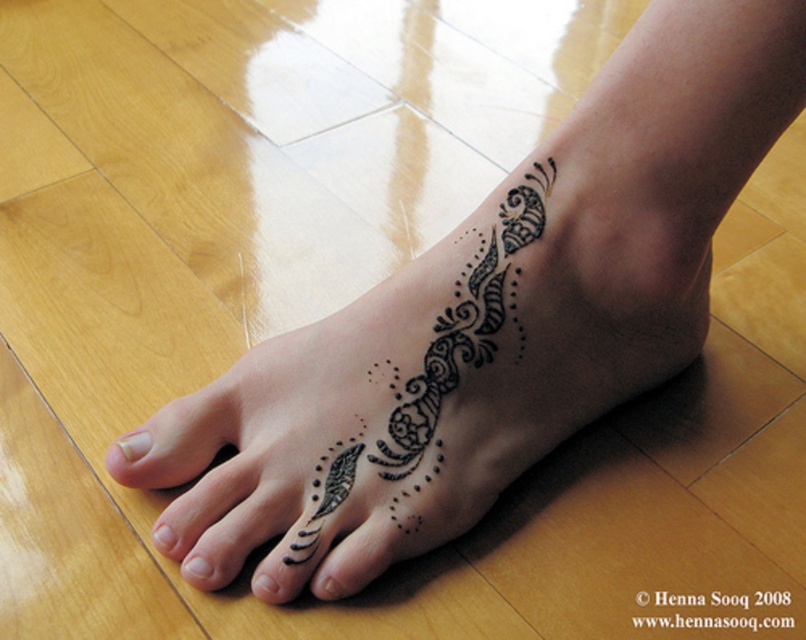
Who is positioned more to the right, black ink dot at lower center or black matte nail at lower left?

black ink dot at lower center

Can you confirm if black ink dot at lower center is wider than black matte nail at lower left?

Yes.

Identify the location of black ink dot at lower center. This screenshot has height=640, width=806. (264, 586).

This screenshot has height=640, width=806. Identify the location of black ink dot at lower center. (264, 586).

Between black ink tattoo at lower center and white matte nail at lower left, which one appears on the right side from the viewer's perspective?

black ink tattoo at lower center is more to the right.

Does point (406, 509) come closer to viewer compared to point (123, 458)?

That is True.

At what (x,y) coordinates should I click in order to perform the action: click on black ink tattoo at lower center. Please return your answer as a coordinate pair (x, y). This screenshot has width=806, height=640. Looking at the image, I should click on (429, 376).

Which of these two, black ink tattoo at lower center or black ink dot at lower center, stands shorter?

With less height is black ink dot at lower center.

Measure the distance between point (x=422, y=404) and camera.

Point (x=422, y=404) is 68.17 centimeters away from camera.

You are a GUI agent. You are given a task and a screenshot of the screen. Output one action in this format:
    pyautogui.click(x=<x>, y=<y>)
    Task: Click on the black ink tattoo at lower center
    The height and width of the screenshot is (640, 806).
    Given the screenshot: What is the action you would take?
    pyautogui.click(x=429, y=376)